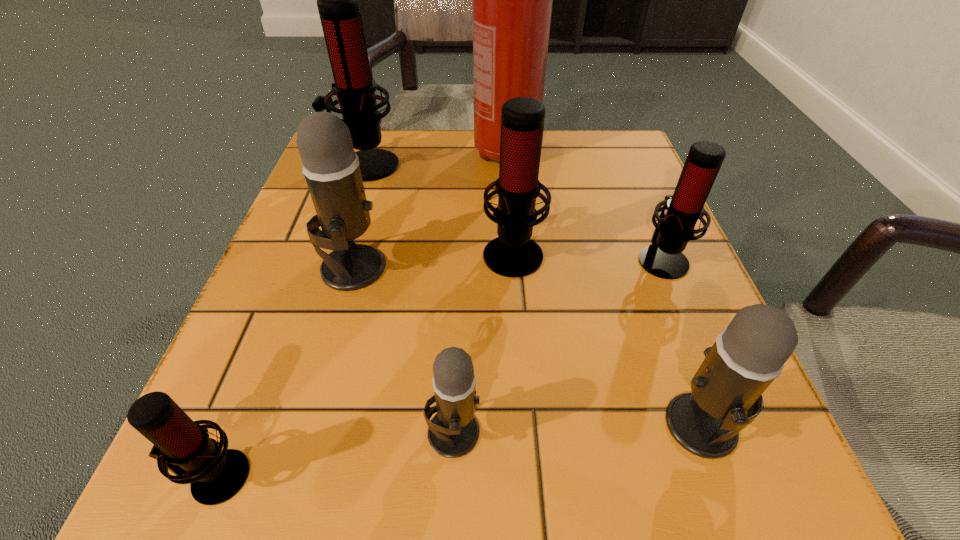
What are the coordinates of `fire extinguisher` in the screenshot? It's located at (512, 0).

I want to click on the tallest object, so click(x=512, y=0).

This screenshot has width=960, height=540. What are the coordinates of `the farthest microphone` in the screenshot? It's located at 337,0.

The image size is (960, 540). Find the location of `the tallest microphone`. the tallest microphone is located at coordinates (337, 0).

Where is `the second biggest red microphone`? the second biggest red microphone is located at coordinates (513, 254).

The height and width of the screenshot is (540, 960). What are the coordinates of `the third microphone from right to left` in the screenshot? It's located at (513, 254).

Find the location of `the leftmost gray microphone`. the leftmost gray microphone is located at coordinates (331, 168).

Where is `the biggest gray microphone`? The image size is (960, 540). the biggest gray microphone is located at coordinates (331, 168).

Locate an element on the screen. the third biggest red microphone is located at coordinates (664, 259).

This screenshot has height=540, width=960. What are the coordinates of `the rightmost gray microphone` in the screenshot? It's located at (725, 397).